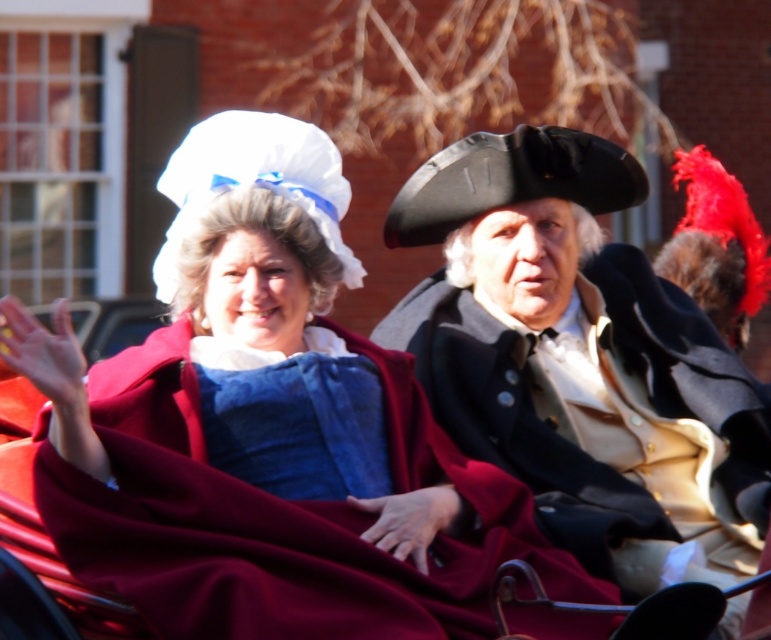
You are a photographer at the historical event and need to arrange the two main subjects for a group photo. The matte blue fabric dress at center and the matte black coat at center are currently overlapping. Which subject should you move to the left to avoid overlap?

The matte black coat at center should be moved to the left to avoid overlapping with the matte blue fabric dress at center, as the blue dress is already positioned on the left side of the black coat.

You are standing in front of the historical parade scene. There are two points marked in the image. The first point is at coordinate point (342, 608) and the second is at point (507, 163). Which point is closer to you?

Point (342, 608) is closer to the viewer than point (507, 163).

You are organizing a historical parade and need to ensure the participants are spaced appropriately. Given that the matte blue fabric dress at center is wider than the matte black coat at center, what is the minimum space required between them to avoid overlapping?

The matte blue fabric dress at center is wider than the matte black coat at center. To avoid overlapping, the minimum space required should be at least the width of the wider object, which is the matte blue fabric dress at center. However, without exact measurements, it is recommended to maintain a distance greater than the width of the matte black coat at center to ensure comfort and prevent contact between the two participants.